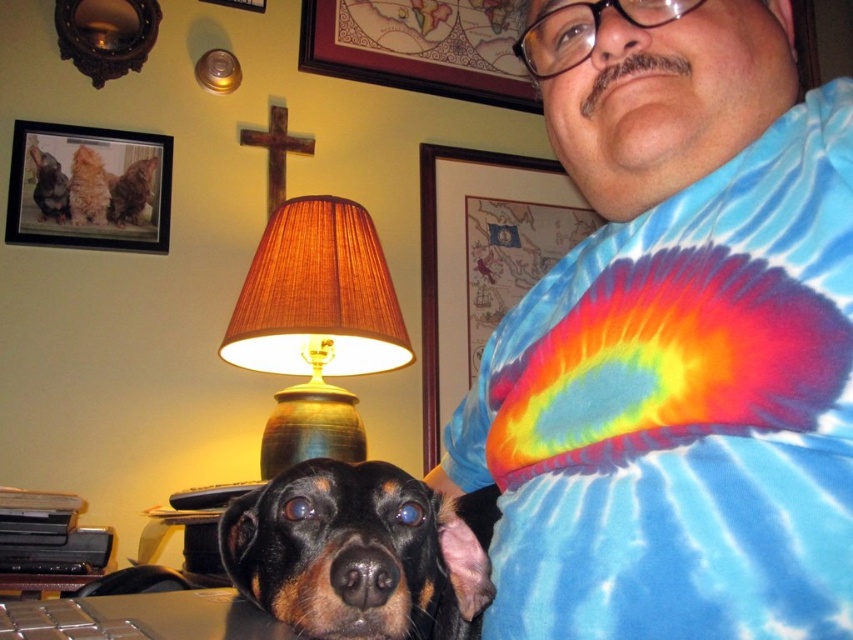
Question: Among these objects, which one is nearest to the camera?

Choices:
 (A) tie-dye fabric at upper right
 (B) brown fabric lampshade at upper center
 (C) wooden framed map at upper center
 (D) wooden frame at upper left

Answer: (B)

Question: From the image, what is the correct spatial relationship of brown fabric lampshade at upper center in relation to black plastic keyboard at lower left?

Choices:
 (A) left
 (B) right

Answer: (A)

Question: Which object is closer to the camera taking this photo?

Choices:
 (A) black fur dog at center
 (B) tie-dye fabric shirt at center
 (C) tie-dye fabric at upper right
 (D) wooden framed map at upper center

Answer: (B)

Question: Can you confirm if tie-dye fabric shirt at center is wider than wooden frame at upper left?

Choices:
 (A) yes
 (B) no

Answer: (B)

Question: Which of these objects is positioned farthest from the brown fabric lampshade at upper center?

Choices:
 (A) tie-dye fabric shirt at center
 (B) tie-dye fabric at upper right
 (C) wooden framed map at upper center
 (D) wooden frame at upper left

Answer: (C)

Question: Can you confirm if brown fabric lampshade at upper center is thinner than wooden framed map at upper center?

Choices:
 (A) yes
 (B) no

Answer: (A)